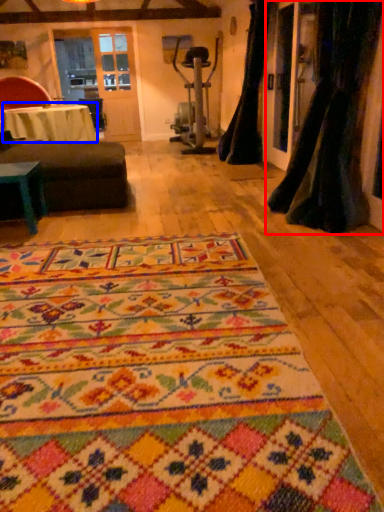
Question: Among these objects, which one is nearest to the camera, curtain (highlighted by a red box) or table (highlighted by a blue box)?

Choices:
 (A) curtain
 (B) table

Answer: (A)